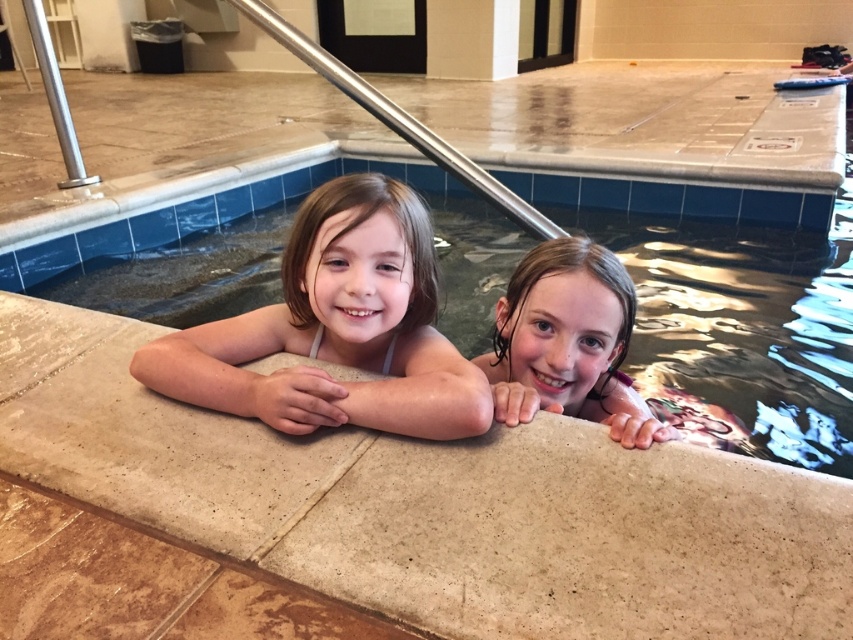
Looking at this image, you are a photographer standing at the edge of the pool. You want to take a photo that includes both the beige stone ledge at center and the smooth skin child at center. Which object should you focus on first to ensure both are in clear view?

You should focus on the beige stone ledge at center first because it is closer to the viewer than the smooth skin child at center, ensuring both are in focus when using a camera with depth of field considerations.

You are a photographer trying to capture a closeup of the wet hair at upper right and the beige stone ledge at center. Which object should you zoom in on first to ensure both are in focus?

The beige stone ledge at center is bigger than wet hair at upper right, so you should zoom in on the beige stone ledge at center first to ensure both are in focus.